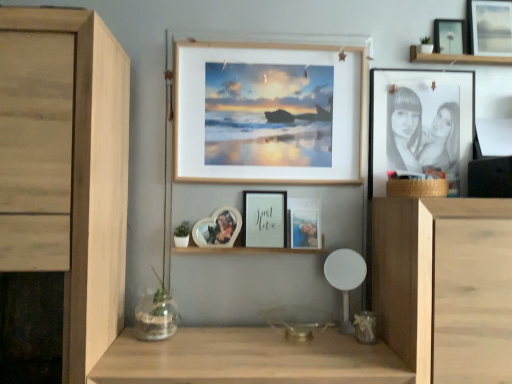
Question: Is matte black picture frame at upper right, marked as the 5th picture frame in a left-to-right arrangement, to the right of clear glass vase at lower left from the viewer's perspective?

Choices:
 (A) no
 (B) yes

Answer: (B)

Question: Considering the relative sizes of matte black picture frame at upper right, which is counted as the second picture frame, starting from the right, and clear glass vase at lower left in the image provided, is matte black picture frame at upper right, which is counted as the second picture frame, starting from the right, smaller than clear glass vase at lower left?

Choices:
 (A) no
 (B) yes

Answer: (B)

Question: Does matte black picture frame at upper right, which is counted as the second picture frame, starting from the right, lie behind clear glass vase at lower left?

Choices:
 (A) yes
 (B) no

Answer: (A)

Question: Is matte black picture frame at upper right, marked as the 5th picture frame in a left-to-right arrangement, oriented towards clear glass vase at lower left?

Choices:
 (A) no
 (B) yes

Answer: (A)

Question: Is matte black picture frame at upper right, which is counted as the second picture frame, starting from the right, not inside clear glass vase at lower left?

Choices:
 (A) yes
 (B) no

Answer: (A)

Question: Does matte black picture frame at upper right, which is counted as the second picture frame, starting from the right, have a larger size compared to clear glass vase at lower left?

Choices:
 (A) yes
 (B) no

Answer: (B)

Question: Is metallic silver photo frame at center, the 4th picture frame positioned from the left, not inside matte black picture frame at upper right, which is counted as the second picture frame, starting from the right?

Choices:
 (A) no
 (B) yes

Answer: (B)

Question: Does metallic silver photo frame at center, the 4th picture frame positioned from the left, turn towards matte black picture frame at upper right, marked as the 5th picture frame in a left-to-right arrangement?

Choices:
 (A) no
 (B) yes

Answer: (A)

Question: Does metallic silver photo frame at center, the 4th picture frame positioned from the left, appear on the left side of matte black picture frame at upper right, marked as the 5th picture frame in a left-to-right arrangement?

Choices:
 (A) yes
 (B) no

Answer: (A)

Question: Is metallic silver photo frame at center, which is the third picture frame from right to left, facing away from matte black picture frame at upper right, which is counted as the second picture frame, starting from the right?

Choices:
 (A) no
 (B) yes

Answer: (A)

Question: Considering the relative sizes of metallic silver photo frame at center, which is the third picture frame from right to left, and matte black picture frame at upper right, marked as the 5th picture frame in a left-to-right arrangement, in the image provided, is metallic silver photo frame at center, which is the third picture frame from right to left, shorter than matte black picture frame at upper right, marked as the 5th picture frame in a left-to-right arrangement,?

Choices:
 (A) no
 (B) yes

Answer: (B)

Question: Is metallic silver photo frame at center, the 4th picture frame positioned from the left, positioned behind matte black picture frame at upper right, which is counted as the second picture frame, starting from the right?

Choices:
 (A) no
 (B) yes

Answer: (A)

Question: Is matte black picture frame at upper right, the 6th picture frame viewed from the left, aimed at heart-shaped photo frame at center, positioned as the 1th picture frame in left-to-right order?

Choices:
 (A) no
 (B) yes

Answer: (A)